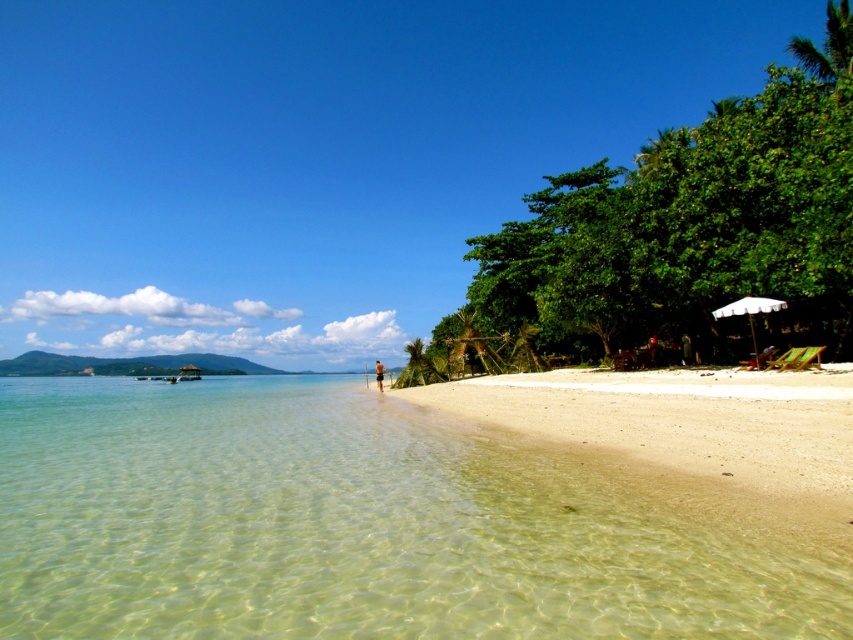
Question: Considering the real-world distances, which object is closest to the white striped umbrella at right?

Choices:
 (A) brown textured shorts at center
 (B) clear water at lower left

Answer: (B)

Question: Can you confirm if white striped umbrella at right is bigger than brown textured shorts at center?

Choices:
 (A) yes
 (B) no

Answer: (B)

Question: Is clear water at lower left wider than brown textured shorts at center?

Choices:
 (A) no
 (B) yes

Answer: (B)

Question: Which point is closer to the camera?

Choices:
 (A) (125, 608)
 (B) (767, 308)
 (C) (376, 371)

Answer: (A)

Question: Which point appears closest to the camera in this image?

Choices:
 (A) (758, 304)
 (B) (378, 360)

Answer: (A)

Question: Does white striped umbrella at right appear on the right side of brown textured shorts at center?

Choices:
 (A) no
 (B) yes

Answer: (B)